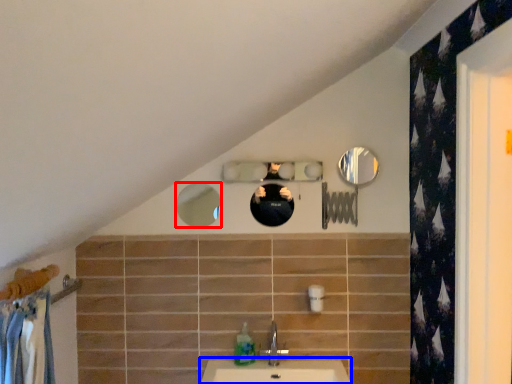
Question: Which object appears closest to the camera in this image, mirror (highlighted by a red box) or counter top (highlighted by a blue box)?

Choices:
 (A) mirror
 (B) counter top

Answer: (B)